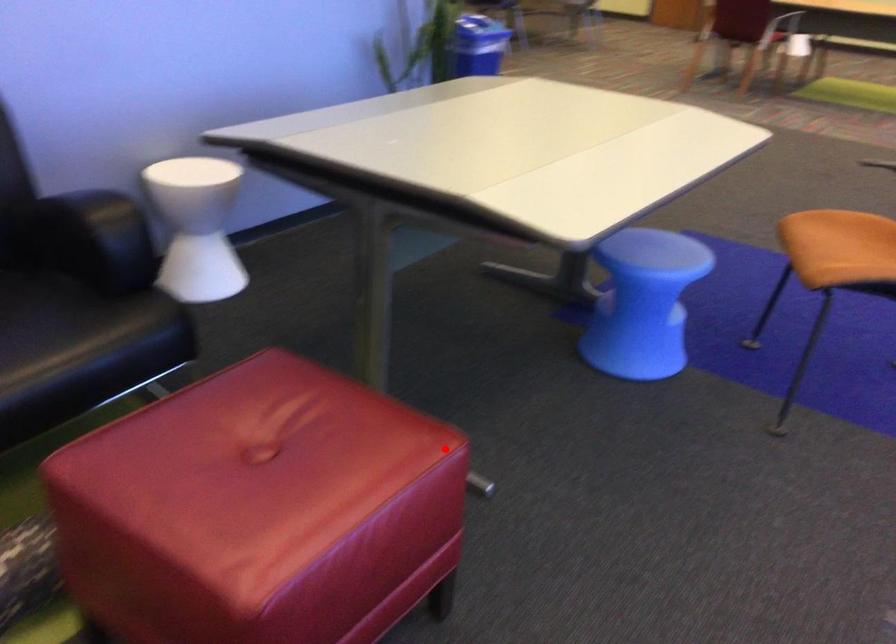
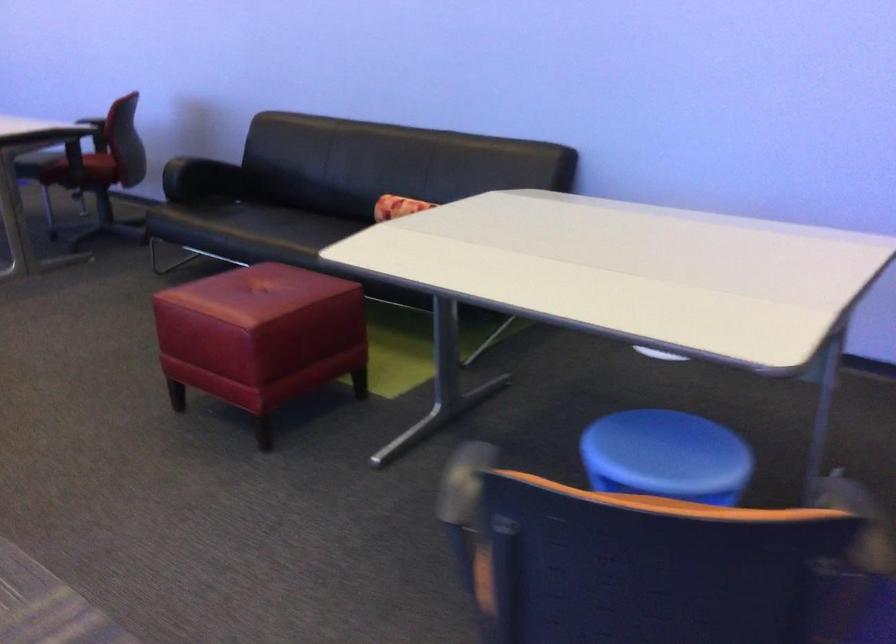
Question: I am providing you with two images of the same scene from different viewpoints. Given a red point in image1, look at the same physical point in image2. Is it:

Choices:
 (A) Closer to the viewpoint
 (B) Farther from the viewpoint

Answer: (B)